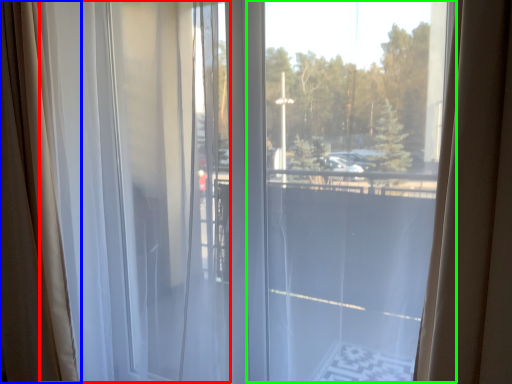
Question: Which object is the farthest from curtain (highlighted by a red box)? Choose among these: curtain (highlighted by a blue box) or glass window (highlighted by a green box).

Choices:
 (A) curtain
 (B) glass window

Answer: (B)